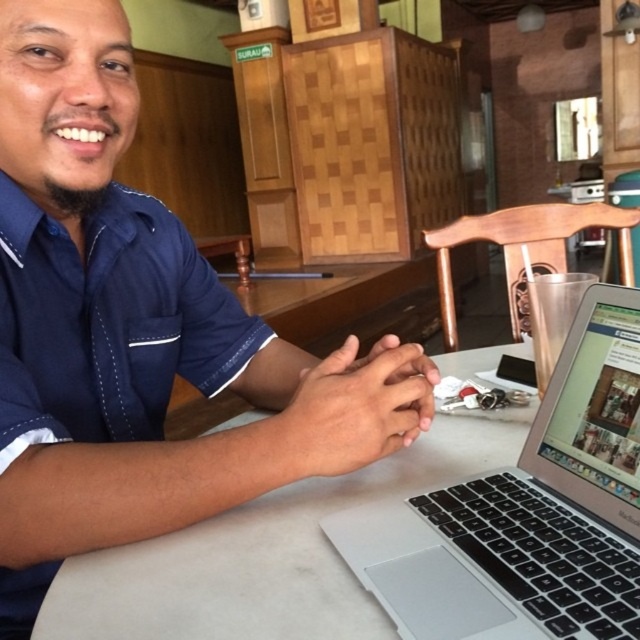
Question: Which object is positioned farthest from the navy blue fabric shirt at center?

Choices:
 (A) white matte table at center
 (B) silver metallic laptop at center
 (C) blue fabric shirt at center

Answer: (B)

Question: Which of the following is the farthest from the observer?

Choices:
 (A) (301, 596)
 (B) (157, 276)
 (C) (404, 561)

Answer: (B)

Question: From the image, what is the correct spatial relationship of silver metallic laptop at center in relation to white matte table at center?

Choices:
 (A) above
 (B) below

Answer: (A)

Question: Is blue fabric shirt at center positioned behind silver metallic laptop at center?

Choices:
 (A) yes
 (B) no

Answer: (A)

Question: Does blue fabric shirt at center have a larger size compared to silver metallic laptop at center?

Choices:
 (A) no
 (B) yes

Answer: (B)

Question: Which object is farther from the camera taking this photo?

Choices:
 (A) silver metallic laptop at center
 (B) white matte table at center
 (C) blue fabric shirt at center

Answer: (C)